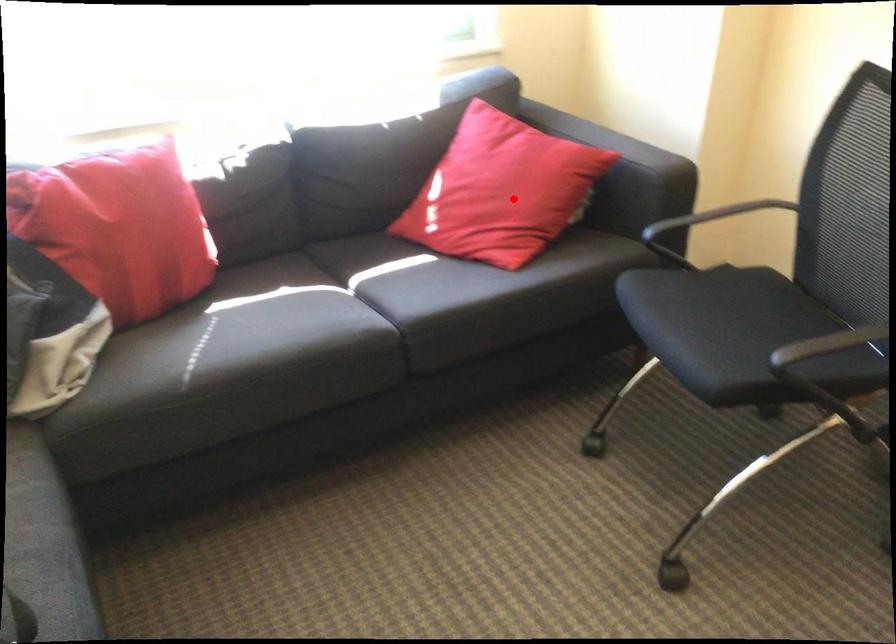
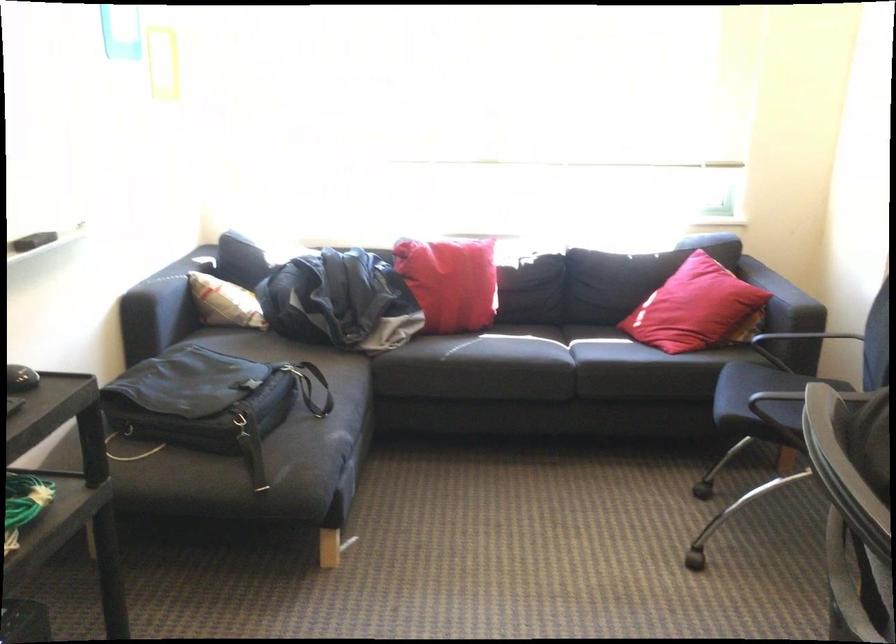
Where in the second image is the point corresponding to the highlighted location from the first image?

(695, 308)